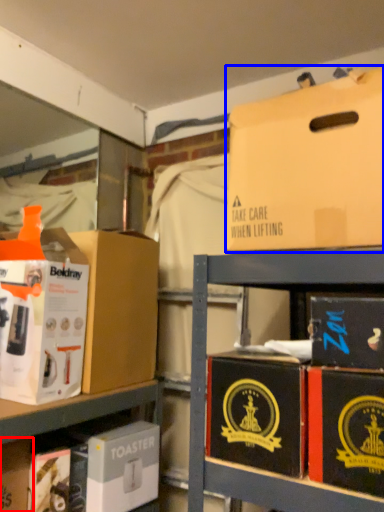
Question: Which object appears closest to the camera in this image, storage box (highlighted by a red box) or box (highlighted by a blue box)?

Choices:
 (A) storage box
 (B) box

Answer: (B)